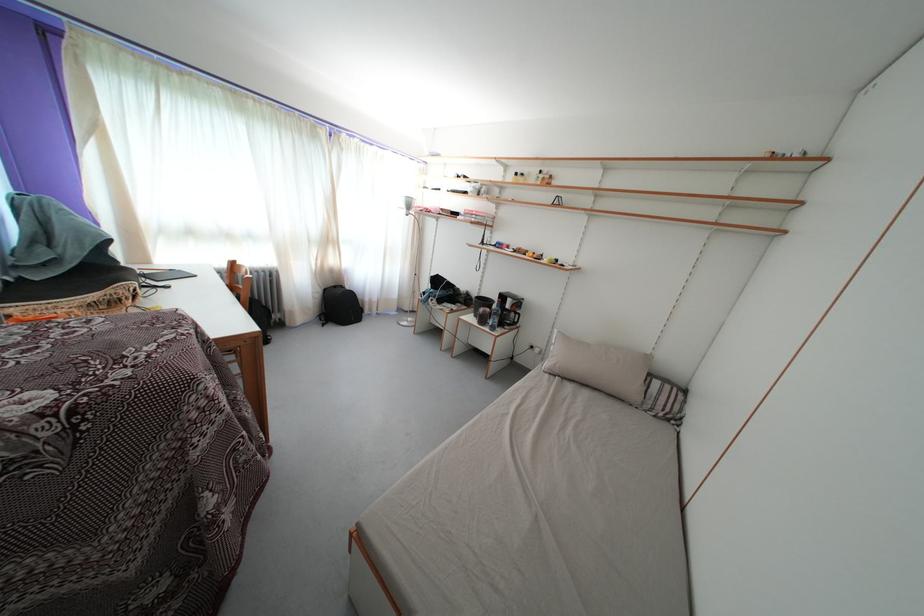
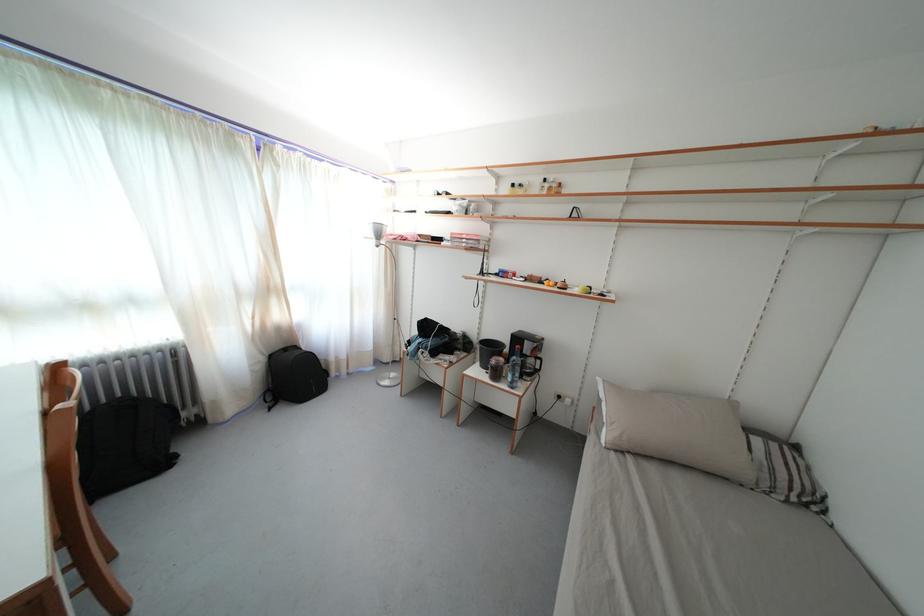
In the second image, find the point that corresponds to point 563,377 in the first image.

(630, 452)